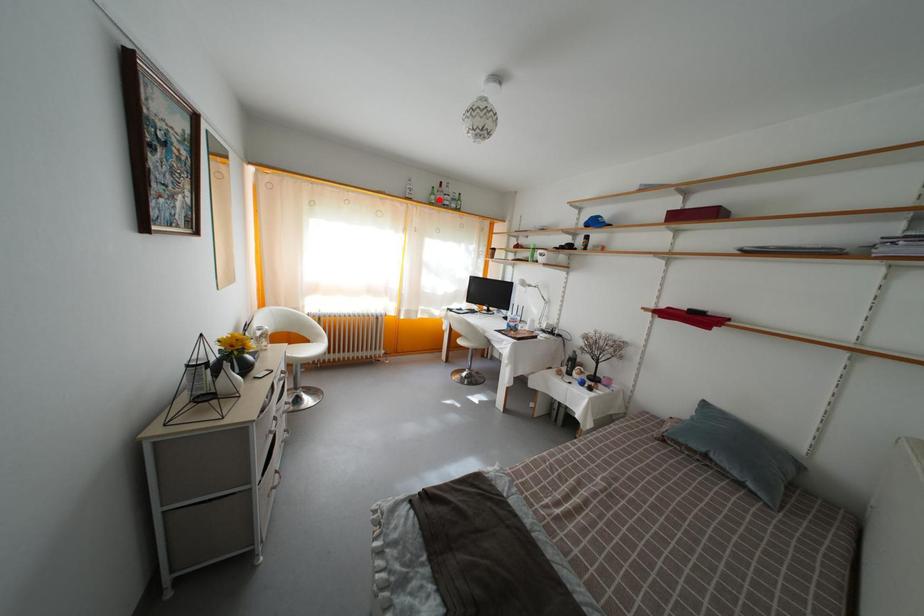
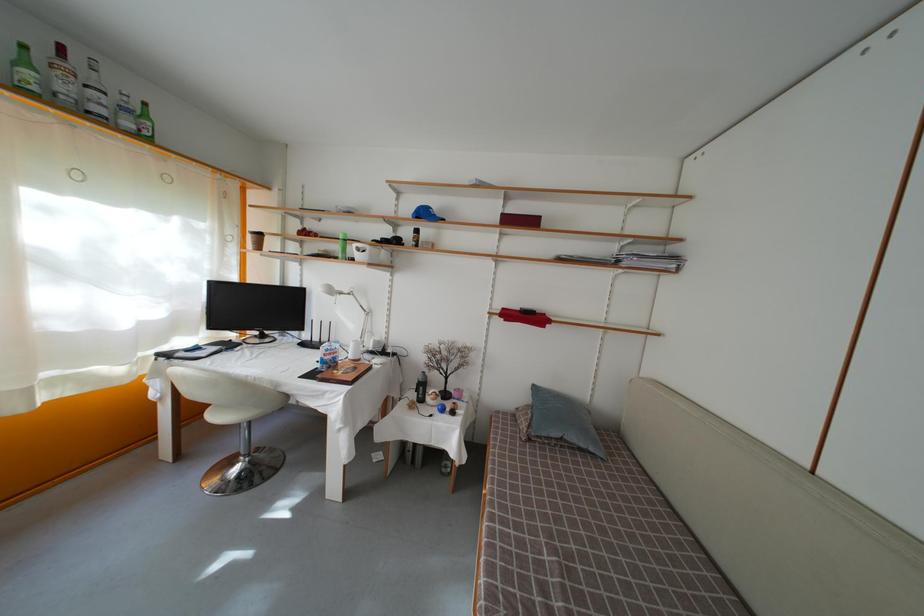
Find the pixel in the second image that matches the highlighted location in the first image.

(31, 69)